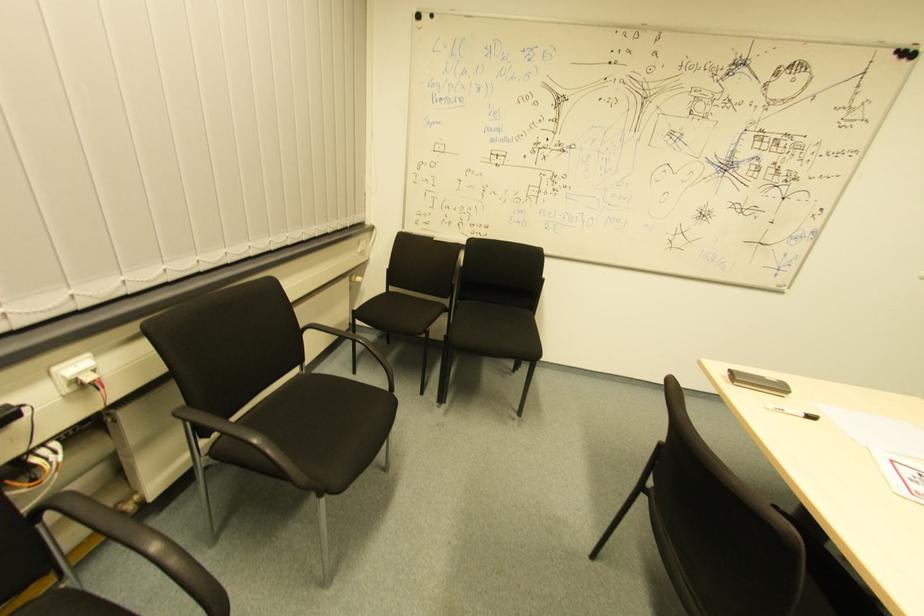
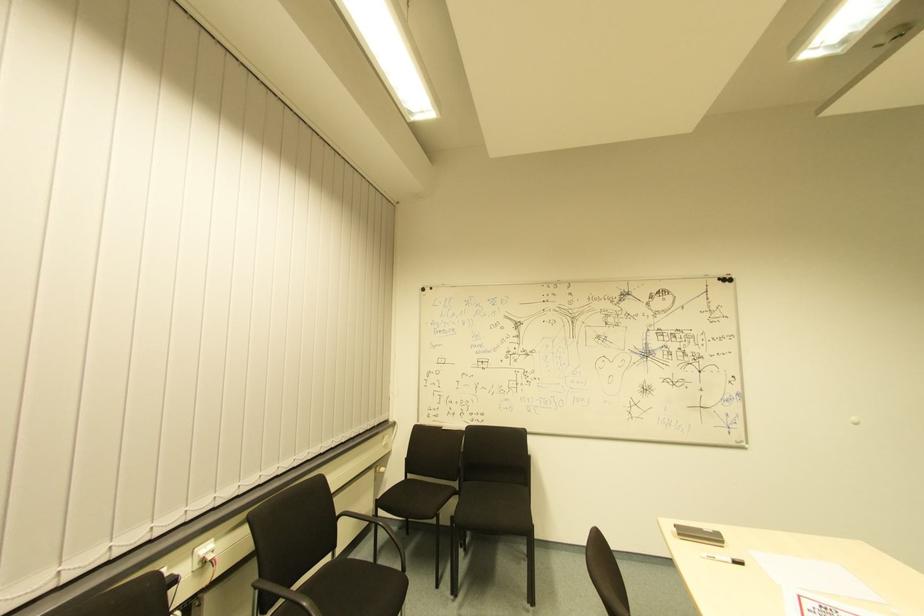
Locate, in the second image, the point that corresponds to point (390, 392) in the first image.

(402, 573)